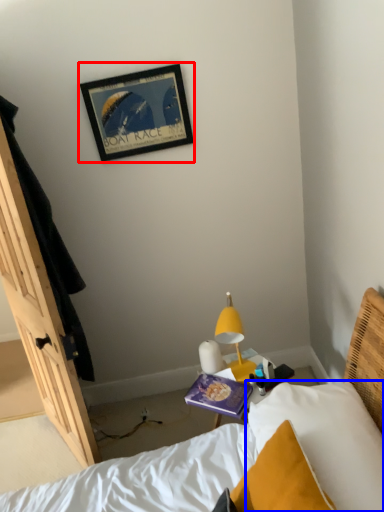
Question: Among these objects, which one is nearest to the camera, picture frame (highlighted by a red box) or pillow (highlighted by a blue box)?

Choices:
 (A) picture frame
 (B) pillow

Answer: (B)